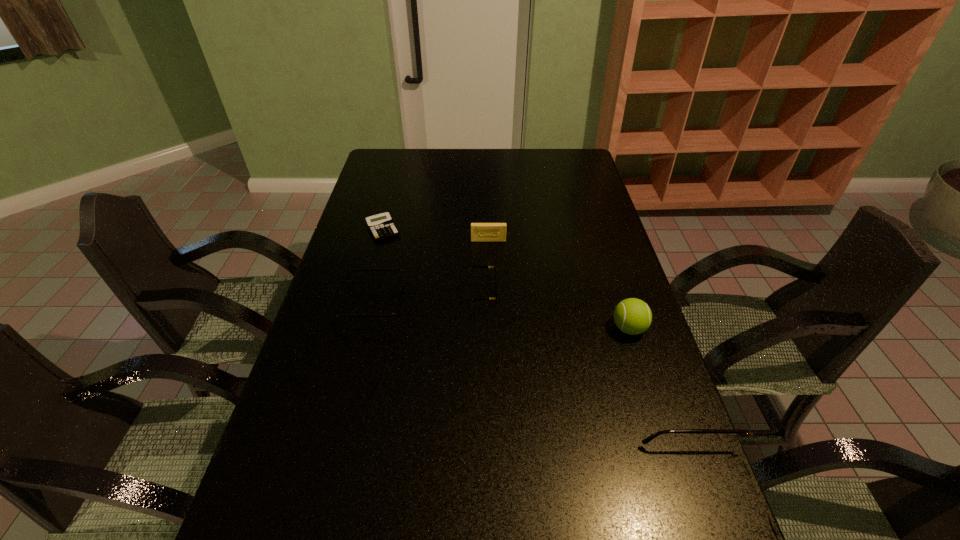
In the image, there is a desktop. At what (x,y) coordinates should I click in order to perform the action: click on vacant space at the far right corner. Please return your answer as a coordinate pair (x, y). Image resolution: width=960 pixels, height=540 pixels. Looking at the image, I should click on (567, 172).

This screenshot has width=960, height=540. In order to click on free point between the shortest object and the tennis ball in this screenshot , I will do `click(506, 279)`.

Identify the location of unoccupied area between the leftmost spectacles and the tallest object. (500, 316).

Find the location of a particular element. free point between the shortest object and the second spectacles from right to left is located at coordinates (430, 261).

Find the location of a particular element. unoccupied area between the calculator and the second shortest spectacles is located at coordinates (377, 267).

I want to click on free space between the second tallest spectacles and the calculator, so click(377, 267).

Identify the location of object identified as the third closest to the tallest object. (480, 232).

Choose which object is the second nearest neighbor to the tallest object. Please provide its 2D coordinates. Your answer should be formatted as a tuple, i.e. [(x, y)], where the tuple contains the x and y coordinates of a point satisfying the conditions above.

[(494, 267)]

Image resolution: width=960 pixels, height=540 pixels. In order to click on the closest spectacles relative to the second tallest spectacles in this screenshot , I will do `click(494, 267)`.

Image resolution: width=960 pixels, height=540 pixels. I want to click on spectacles that stands as the third closest to the calculator, so click(x=785, y=523).